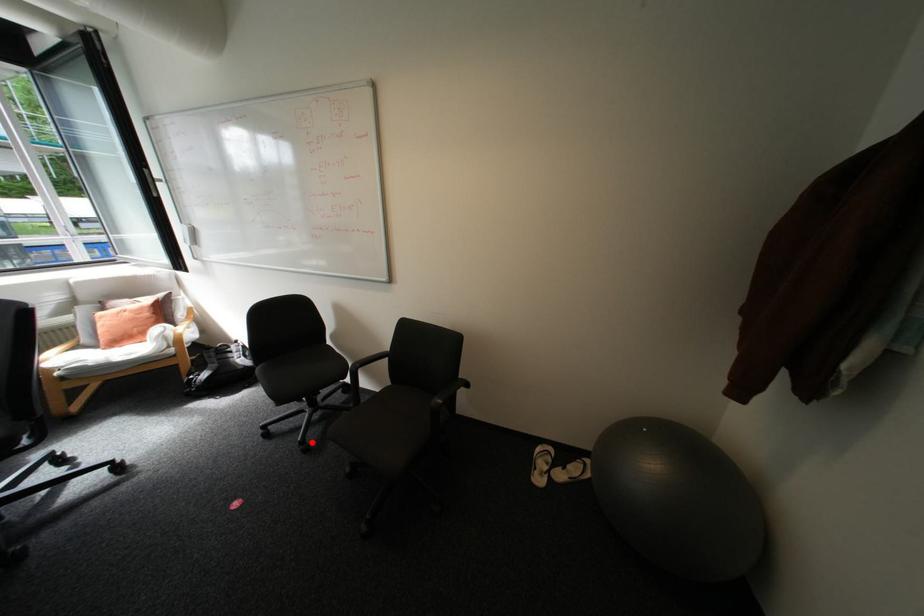
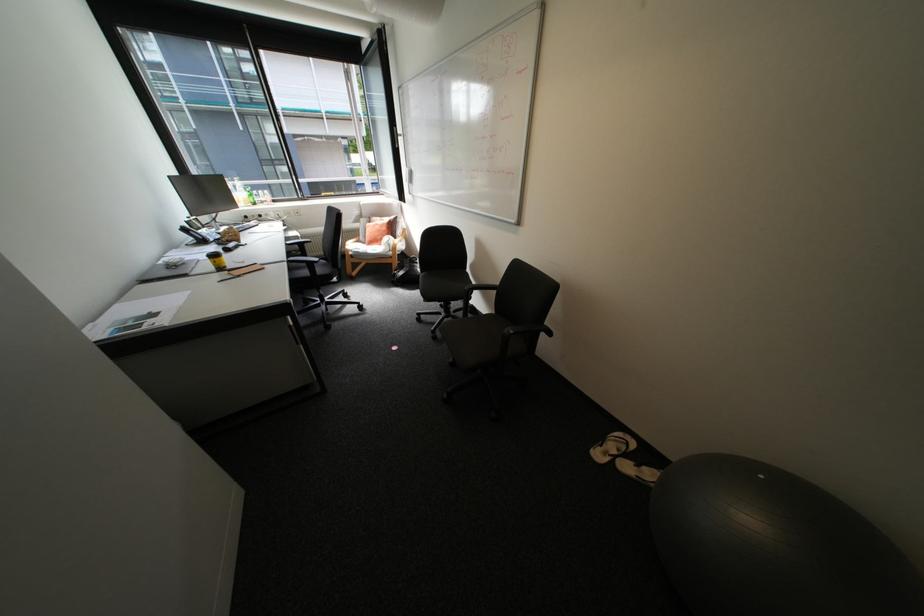
Question: I am providing you with two images of the same scene from different viewpoints. A red point is marked on the first image. At the location where the point appears in image 1, is it still visible in image 2?

Choices:
 (A) Yes
 (B) No

Answer: (A)